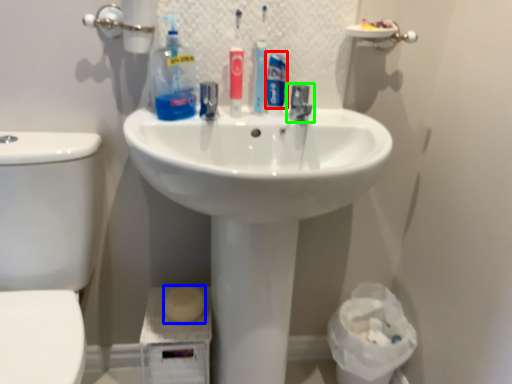
Question: Which is farther away from personal care (highlighted by a red box)? soap (highlighted by a blue box) or tap (highlighted by a green box)?

Choices:
 (A) soap
 (B) tap

Answer: (A)